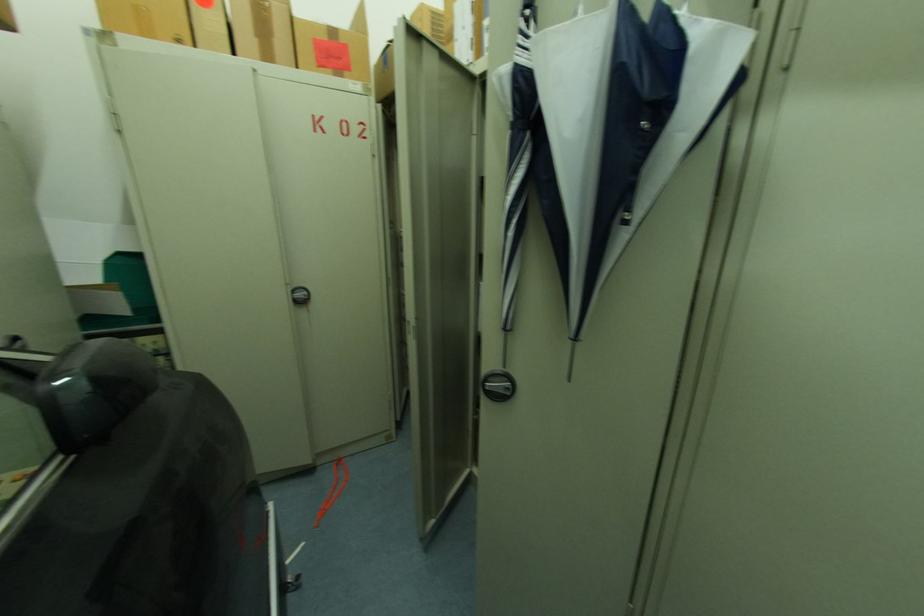
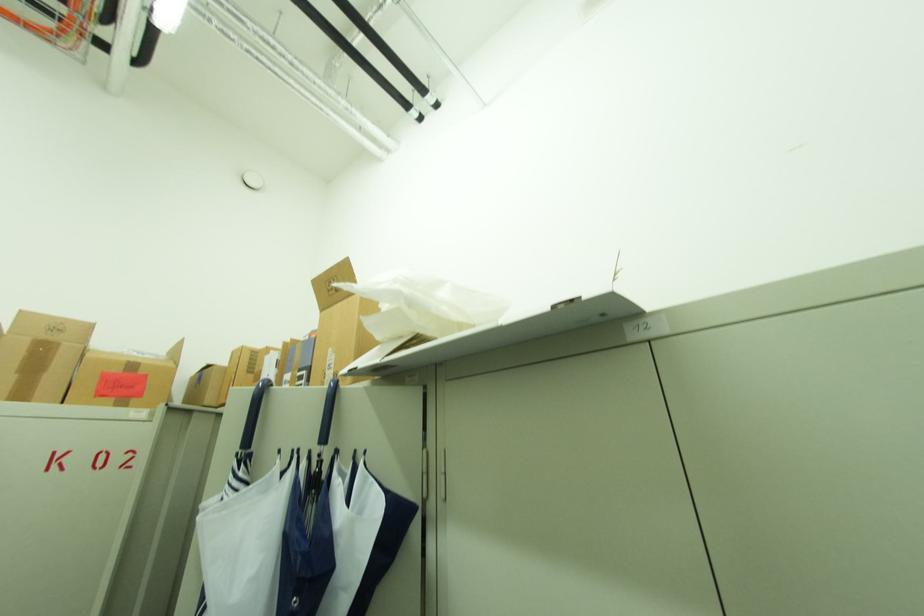
The images are taken continuously from a first-person perspective. In which direction is your viewpoint rotating?

The camera's rotation is toward right-up.